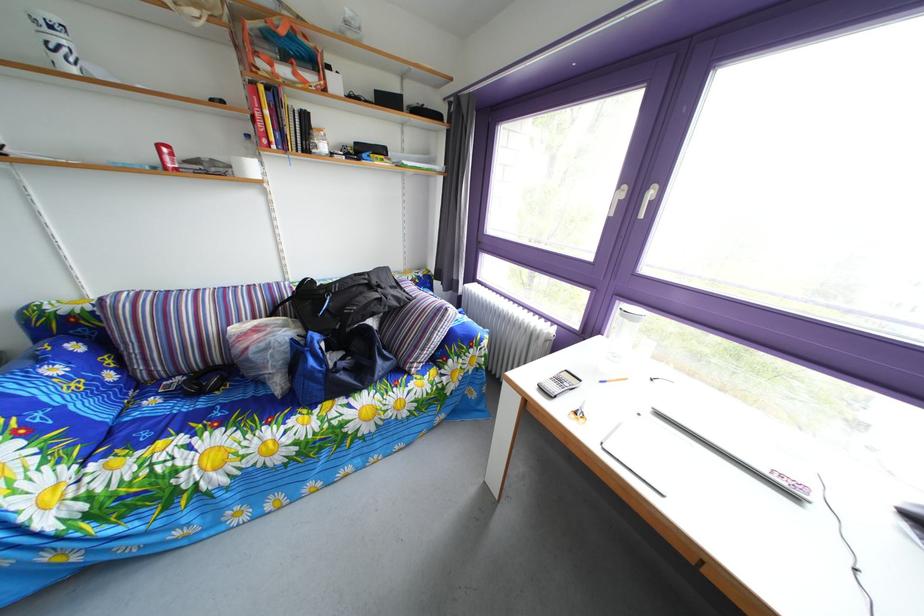
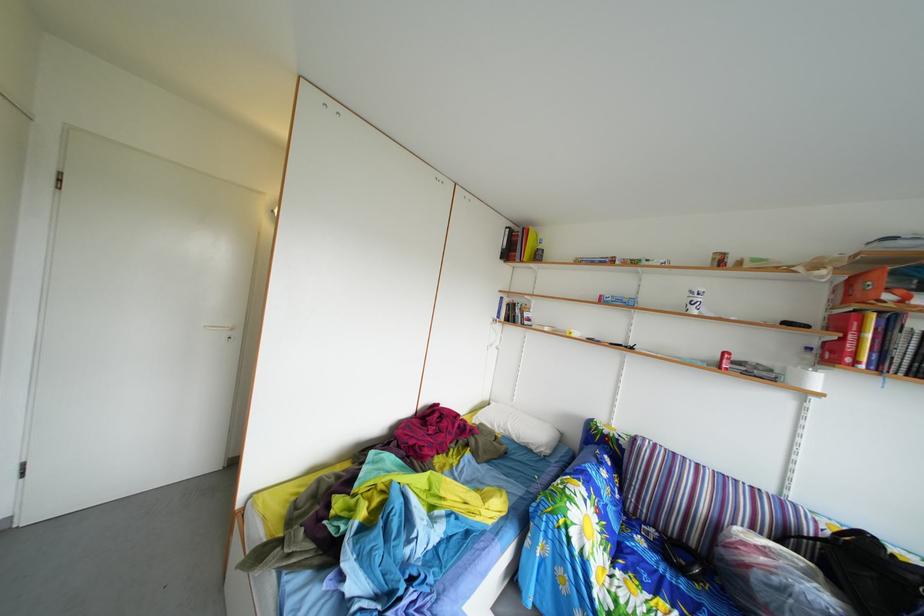
Question: Based on the continuous images, in which direction is the camera rotating? Reply with the corresponding letter.

Choices:
 (A) Left
 (B) Right
 (C) Up
 (D) Down

Answer: (A)